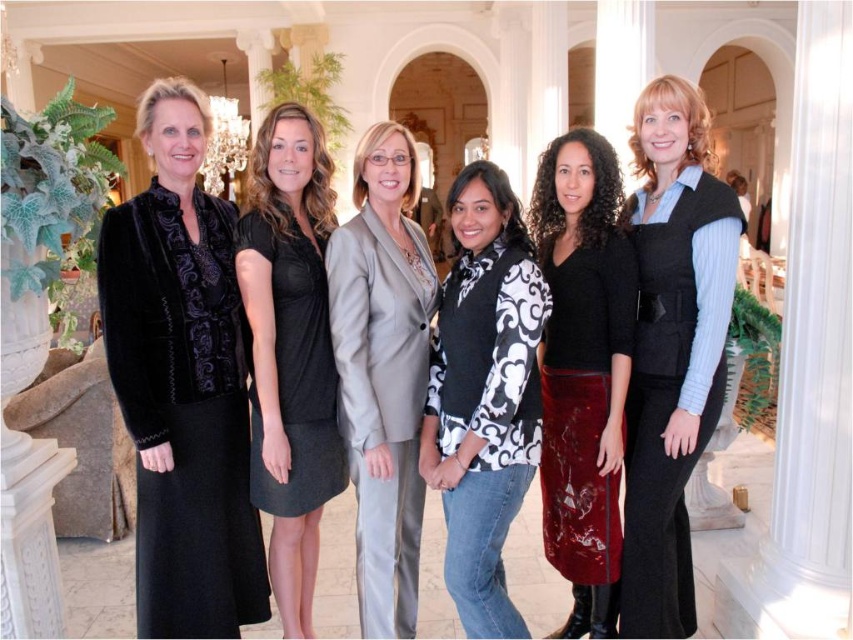
You are organizing a photoshoot and need to ensure that the black and white patterned top at center and the velvet skirt at center are both visible in the frame. Given their sizes, which one should you focus on framing first to accommodate both?

The black and white patterned top at center is larger in size than the velvet skirt at center, so you should focus on framing the black and white patterned top at center first to ensure both fit within the frame.

You are at a formal event and notice two attendees wearing black and white patterned top at center and velvet black vest at center. Which one is positioned to the right?

The velvet black vest at center is positioned to the right of the black and white patterned top at center.

You are standing in the grand hall and want to locate the black dress at center. According to the coordinates provided, where exactly would you find it?

→ The black dress at center is located at the coordinates point (289, 349).